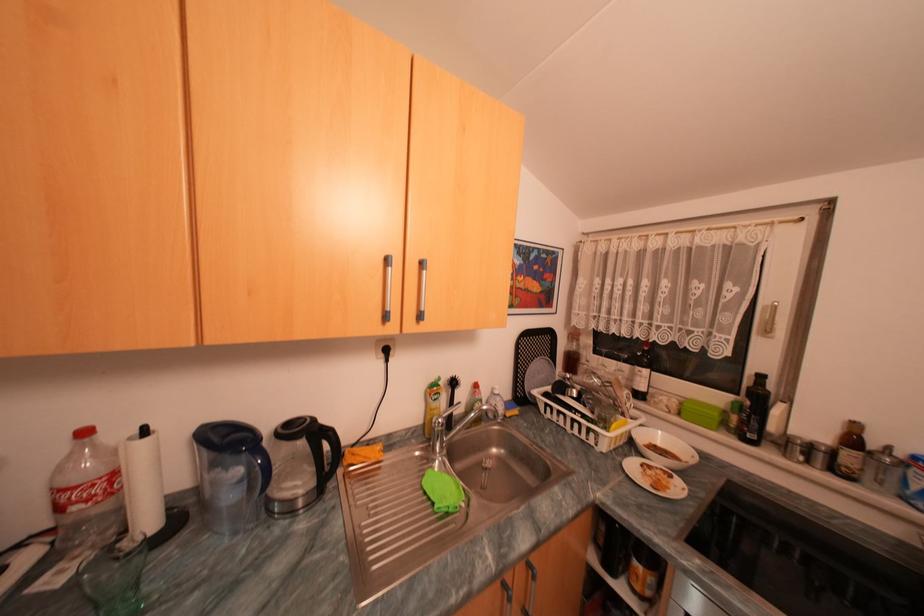
Where would you pour the black kettle handle? Please return your answer as a coordinate pair (x, y).

(331, 456)